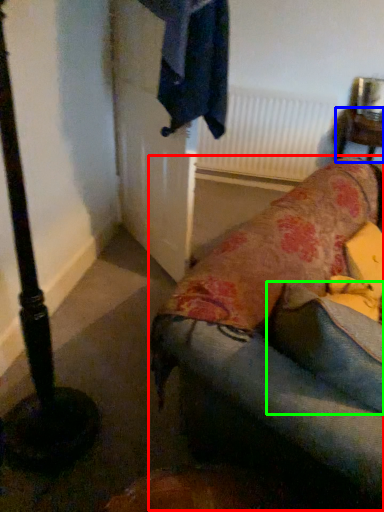
Question: Based on their relative distances, which object is nearer to studio couch (highlighted by a red box)? Choose from furniture (highlighted by a blue box) and pillow (highlighted by a green box).

Choices:
 (A) furniture
 (B) pillow

Answer: (B)